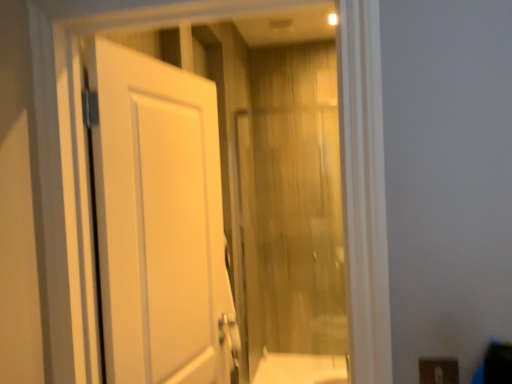
Question: Is translucent wood curtain at center situated inside brown matte electric outlet at lower right or outside?

Choices:
 (A) outside
 (B) inside

Answer: (A)

Question: Considering the relative positions of translucent wood curtain at center and brown matte electric outlet at lower right in the image provided, is translucent wood curtain at center to the left or to the right of brown matte electric outlet at lower right?

Choices:
 (A) left
 (B) right

Answer: (A)

Question: Considering the real-world distances, which object is farthest from the brown matte electric outlet at lower right?

Choices:
 (A) white matte door at left
 (B) translucent wood curtain at center

Answer: (B)

Question: Considering the real-world distances, which object is closest to the white matte door at left?

Choices:
 (A) translucent wood curtain at center
 (B) brown matte electric outlet at lower right

Answer: (B)